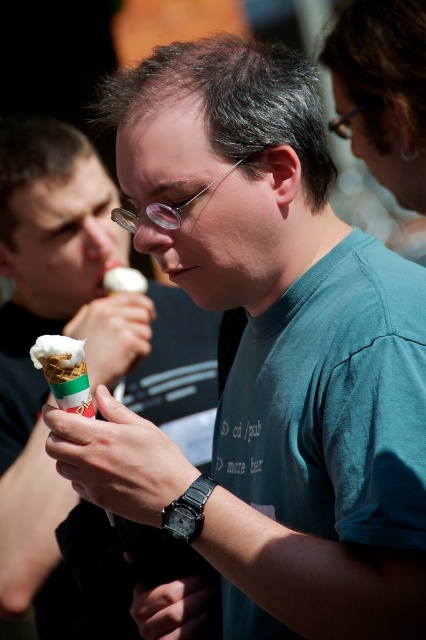
Question: Can you confirm if white creamy ice cream at lower left is bigger than metallic frame glasses at upper center?

Choices:
 (A) yes
 (B) no

Answer: (B)

Question: Which of the following is the farthest from the observer?

Choices:
 (A) (37, 224)
 (B) (112, 276)
 (C) (350, 116)

Answer: (B)

Question: Which of the following is the closest to the observer?

Choices:
 (A) metallic frame glasses at upper center
 (B) white creamy ice cream cone at left
 (C) clear plastic glasses at center

Answer: (C)

Question: Is white creamy ice cream at lower left thinner than white creamy ice cream at center?

Choices:
 (A) no
 (B) yes

Answer: (B)

Question: Which object is farther from the camera taking this photo?

Choices:
 (A) white creamy ice cream cone at left
 (B) clear plastic glasses at center
 (C) metallic frame glasses at upper center

Answer: (A)

Question: Is white creamy ice cream at lower left below clear plastic glasses at center?

Choices:
 (A) yes
 (B) no

Answer: (A)